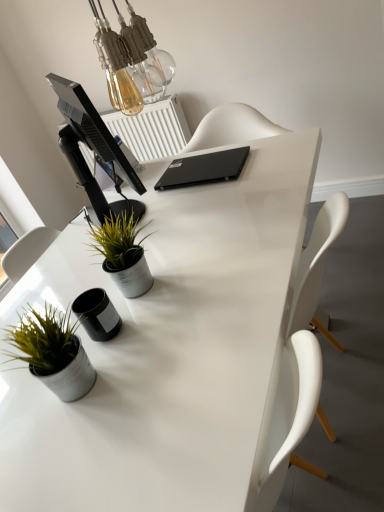
The width and height of the screenshot is (384, 512). Find the location of `vacant space positioned to the left of black matte laptop at center`. vacant space positioned to the left of black matte laptop at center is located at coordinates point(135,200).